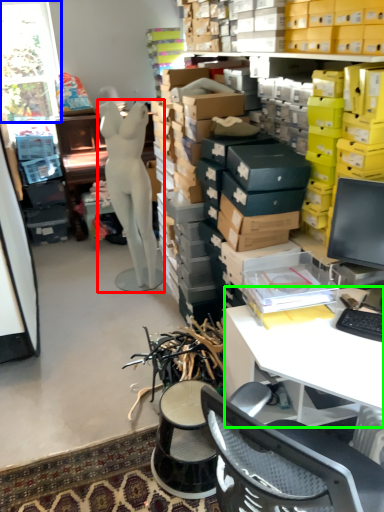
Question: Which is nearer to the person (highlighted by a red box)? window (highlighted by a blue box) or desk (highlighted by a green box).

Choices:
 (A) window
 (B) desk

Answer: (A)